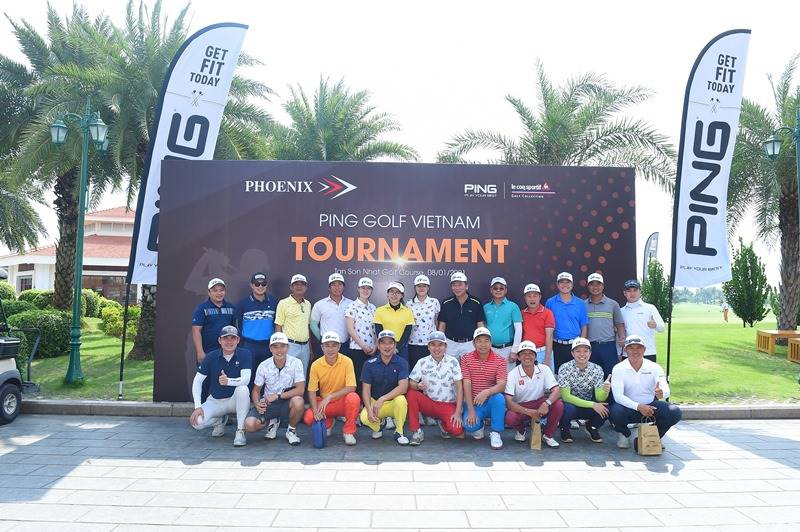
The width and height of the screenshot is (800, 532). I want to click on bench, so click(769, 332), click(786, 338).